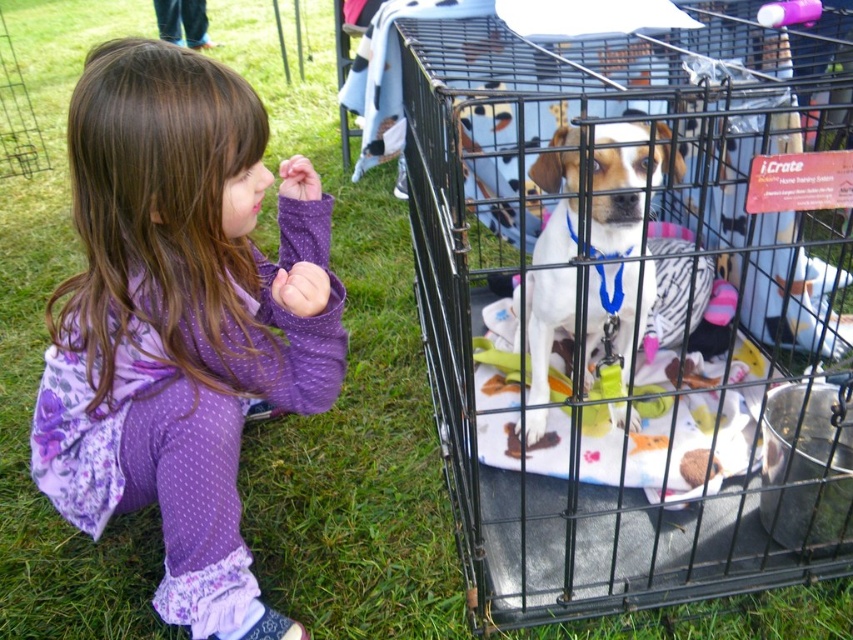
Is black wire cage at center smaller than purple polka dot dress at lower left?

Incorrect, black wire cage at center is not smaller in size than purple polka dot dress at lower left.

Between point (741, 572) and point (207, 582), which one is positioned behind?

The point (741, 572) is more distant.

Find the location of a particular element. Image resolution: width=853 pixels, height=640 pixels. black wire cage at center is located at coordinates (640, 353).

Who is taller, black wire cage at center or white fur dog at center?

With more height is black wire cage at center.

Who is more forward, (431, 237) or (666, 129)?

Point (666, 129) is more forward.

In the scene shown: Who is more forward, (515, 248) or (596, 257)?

Point (596, 257) is more forward.

Identify the location of black wire cage at center. The height and width of the screenshot is (640, 853). (640, 353).

Between purple polka dot dress at lower left and white fur dog at center, which one appears on the right side from the viewer's perspective?

white fur dog at center

Is point (231, 468) positioned after point (567, 129)?

No, (231, 468) is in front of (567, 129).

Find the location of `purple polka dot dress at lower left`. purple polka dot dress at lower left is located at coordinates pyautogui.click(x=181, y=321).